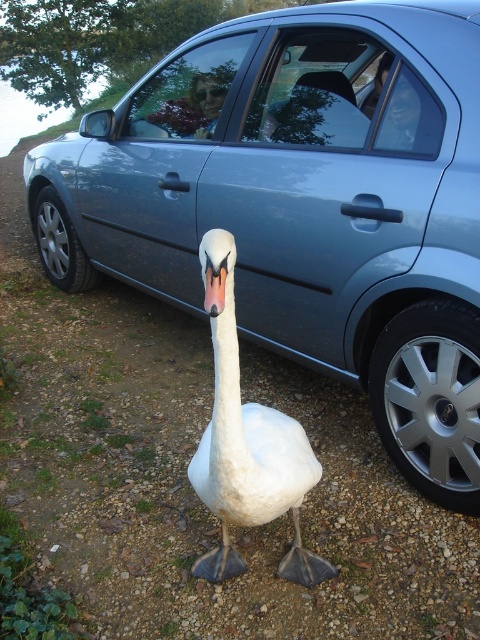
Question: Which of the following is the closest to the observer?

Choices:
 (A) white feathered swan at center
 (B) silver metallic tire at left
 (C) white matte beak at center

Answer: (C)

Question: Among these points, which one is farthest from the camera?

Choices:
 (A) (463, 332)
 (B) (93, 285)

Answer: (B)

Question: Is white feathered swan at center below white matte beak at center?

Choices:
 (A) no
 (B) yes

Answer: (B)

Question: Which of the following is the closest to the observer?

Choices:
 (A) silver metallic wheel at lower right
 (B) white matte beak at center

Answer: (B)

Question: Can you confirm if white feathered swan at center is positioned to the left of white matte beak at center?

Choices:
 (A) no
 (B) yes

Answer: (A)

Question: Does silver metallic wheel at lower right appear on the right side of white matte beak at center?

Choices:
 (A) yes
 (B) no

Answer: (A)